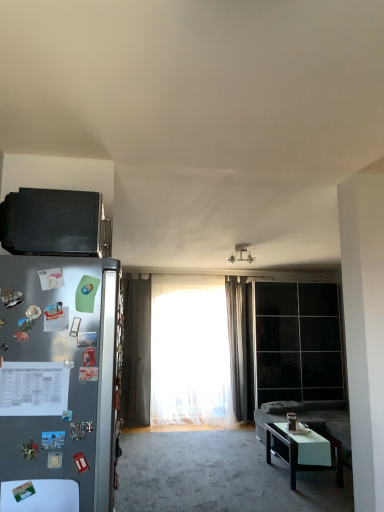
Question: Does black glossy coffee table at lower right touch satin silver refrigerator at left?

Choices:
 (A) yes
 (B) no

Answer: (B)

Question: Is black glossy coffee table at lower right positioned beyond the bounds of satin silver refrigerator at left?

Choices:
 (A) no
 (B) yes

Answer: (B)

Question: From the image's perspective, is black glossy coffee table at lower right located above satin silver refrigerator at left?

Choices:
 (A) yes
 (B) no

Answer: (B)

Question: Can you confirm if black glossy coffee table at lower right is positioned to the right of satin silver refrigerator at left?

Choices:
 (A) yes
 (B) no

Answer: (A)

Question: Is black glossy coffee table at lower right wider than satin silver refrigerator at left?

Choices:
 (A) yes
 (B) no

Answer: (B)

Question: Is white glossy table at lower left inside the boundaries of black matte microwave at upper left, or outside?

Choices:
 (A) inside
 (B) outside

Answer: (B)

Question: Does point (8, 480) appear closer or farther from the camera than point (71, 229)?

Choices:
 (A) closer
 (B) farther

Answer: (A)

Question: Is white glossy table at lower left taller or shorter than black matte microwave at upper left?

Choices:
 (A) tall
 (B) short

Answer: (B)

Question: In the image, is white glossy table at lower left positioned in front of or behind black matte microwave at upper left?

Choices:
 (A) front
 (B) behind

Answer: (A)

Question: In the image, is white sheer curtain at center, arranged as the second curtain when viewed from the right, on the left side or the right side of black glossy coffee table at lower right?

Choices:
 (A) left
 (B) right

Answer: (A)

Question: Is white sheer curtain at center, positioned as the first curtain in left-to-right order, bigger or smaller than black glossy coffee table at lower right?

Choices:
 (A) small
 (B) big

Answer: (B)

Question: Is white sheer curtain at center, arranged as the second curtain when viewed from the right, spatially inside black glossy coffee table at lower right, or outside of it?

Choices:
 (A) outside
 (B) inside

Answer: (A)

Question: Considering the positions of white sheer curtain at center, positioned as the first curtain in left-to-right order, and black glossy coffee table at lower right in the image, is white sheer curtain at center, positioned as the first curtain in left-to-right order, taller or shorter than black glossy coffee table at lower right?

Choices:
 (A) tall
 (B) short

Answer: (A)

Question: Considering the positions of white glossy table at lower left and black glossy coffee table at lower right in the image, is white glossy table at lower left taller or shorter than black glossy coffee table at lower right?

Choices:
 (A) tall
 (B) short

Answer: (B)

Question: Considering the positions of white glossy table at lower left and black glossy coffee table at lower right in the image, is white glossy table at lower left wider or thinner than black glossy coffee table at lower right?

Choices:
 (A) wide
 (B) thin

Answer: (B)